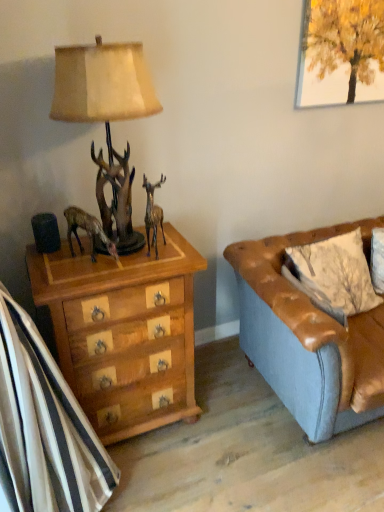
Question: Looking at the image, does leather pillow at right seem bigger or smaller compared to metallic gold reindeer at center?

Choices:
 (A) big
 (B) small

Answer: (A)

Question: From a real-world perspective, is leather pillow at right physically located above or below metallic gold reindeer at center?

Choices:
 (A) below
 (B) above

Answer: (A)

Question: Considering the real-world distances, which object is farthest from the matte brown lamp at left?

Choices:
 (A) antique brown statue at left
 (B) metallic gold reindeer at center
 (C) wooden chest of drawers at left
 (D) leather pillow at right
 (E) brown leather couch at right

Answer: (D)

Question: Which of these objects is positioned closest to the leather pillow at right?

Choices:
 (A) matte brown lamp at left
 (B) antique brown statue at left
 (C) brown leather couch at right
 (D) metallic gold reindeer at center
 (E) wooden chest of drawers at left

Answer: (C)